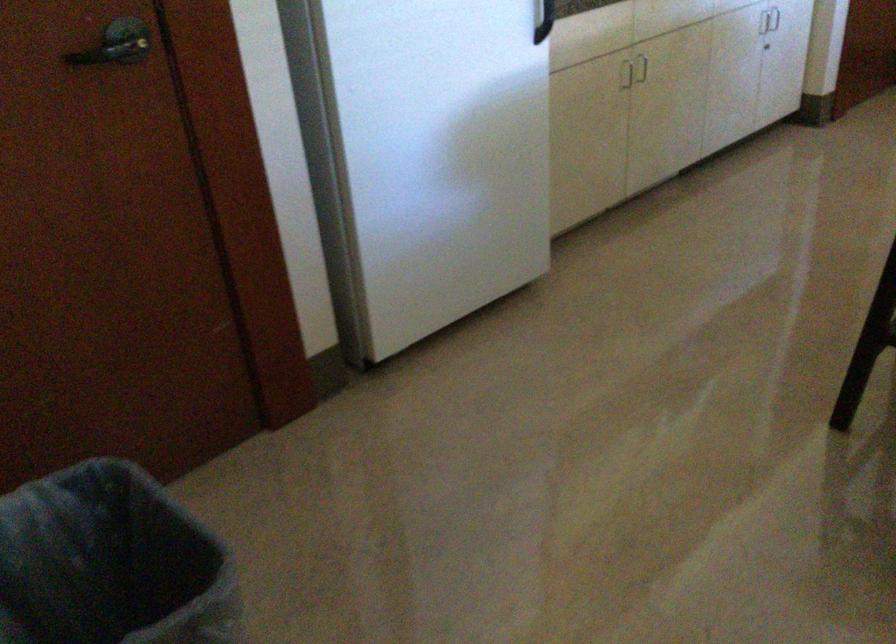
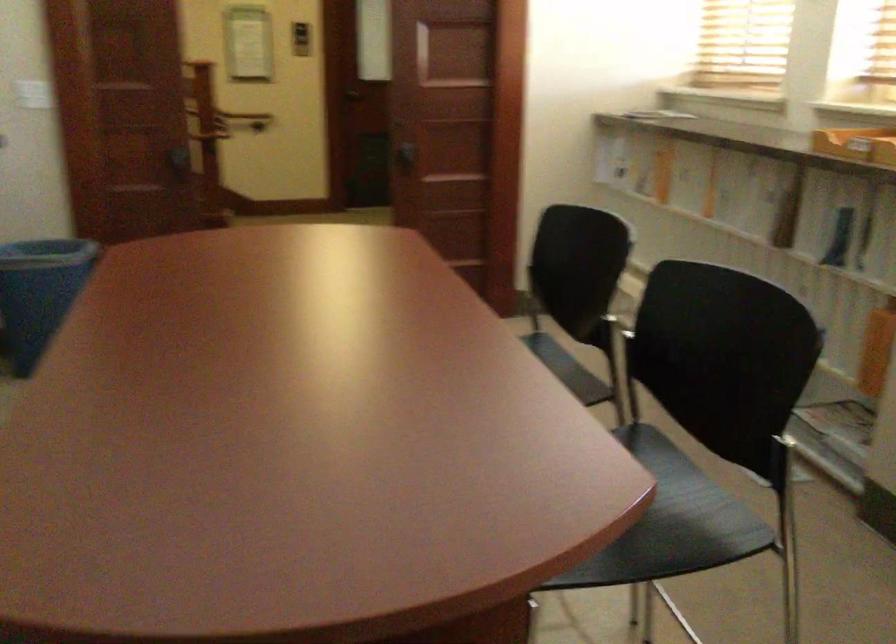
Question: The images are taken continuously from a first-person perspective. In which direction is your viewpoint rotating?

Choices:
 (A) Left
 (B) Right
 (C) Up
 (D) Down

Answer: (B)